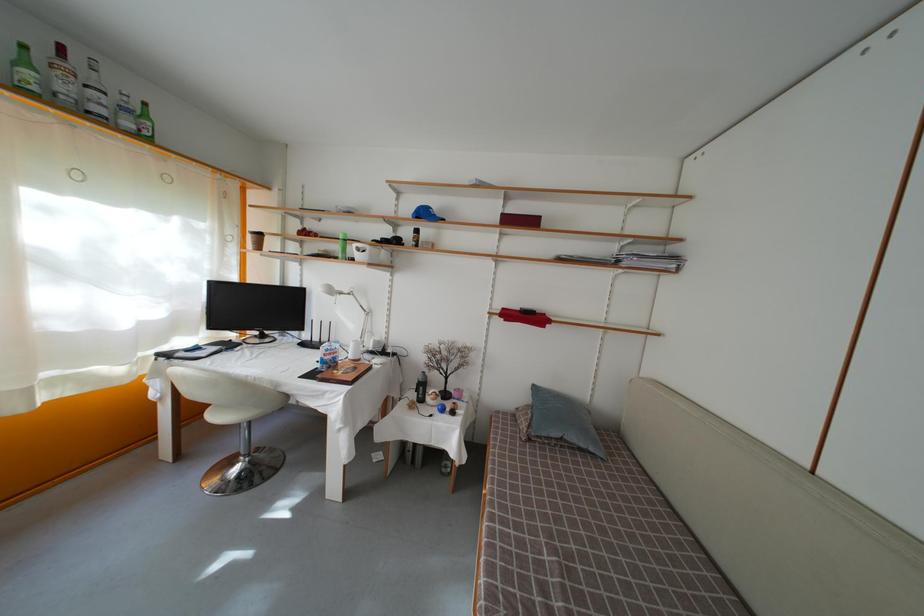
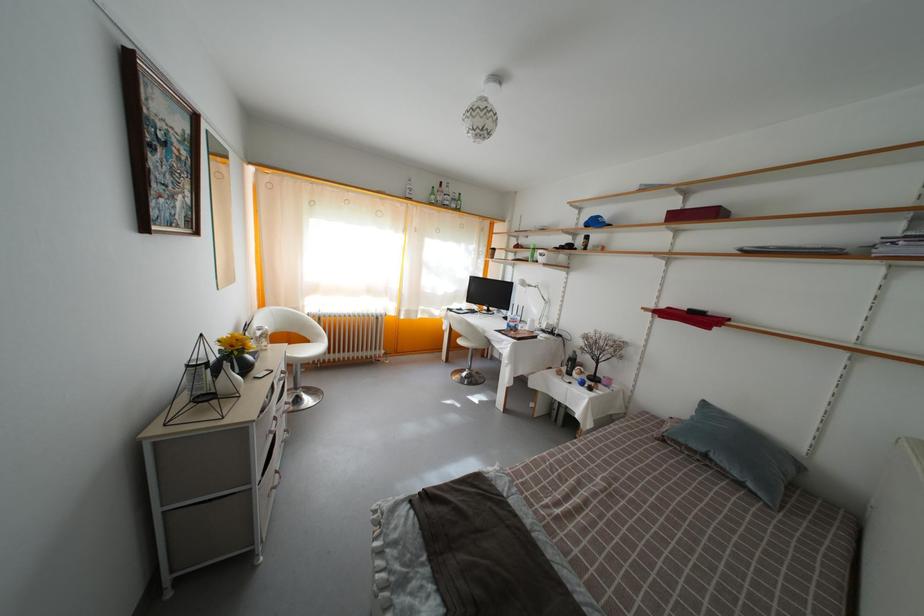
The point at (402,213) is marked in the first image. Where is the corresponding point in the second image?

(584, 225)